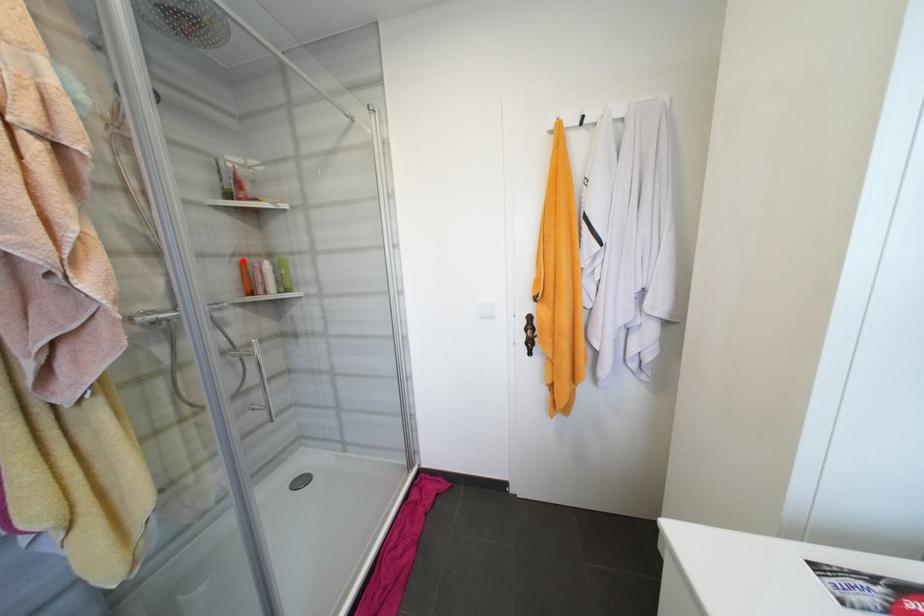
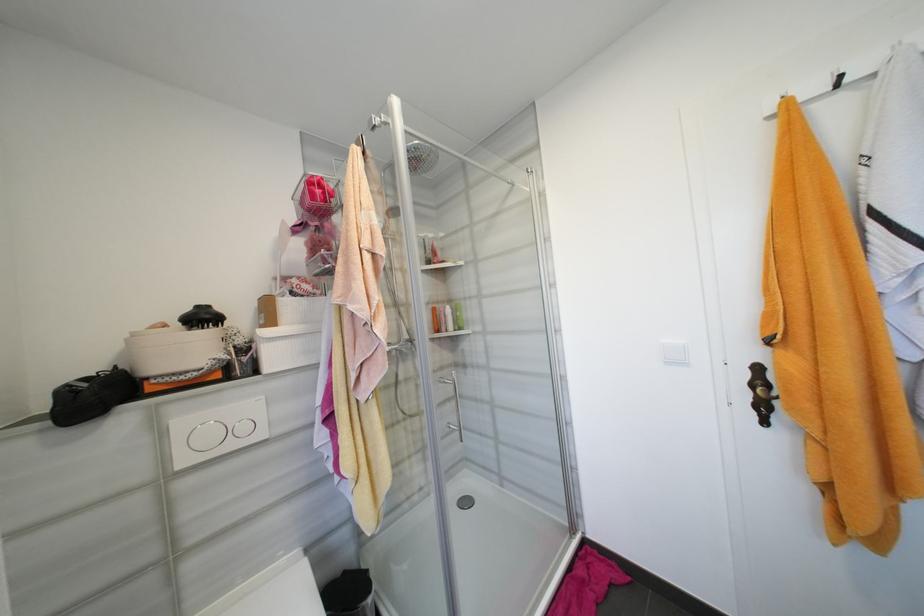
Locate, in the second image, the point that corresponds to the highlighted location in the first image.

(436, 307)